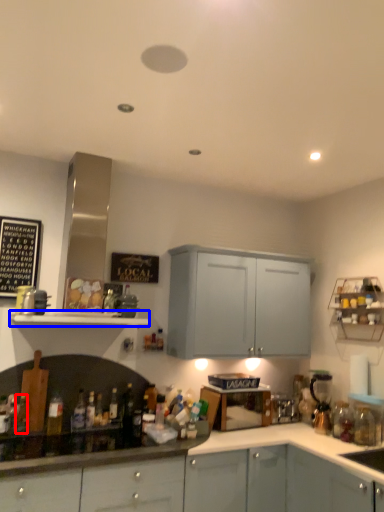
Question: Which object is further to the camera taking this photo, bottle (highlighted by a red box) or shelf (highlighted by a blue box)?

Choices:
 (A) bottle
 (B) shelf

Answer: (A)